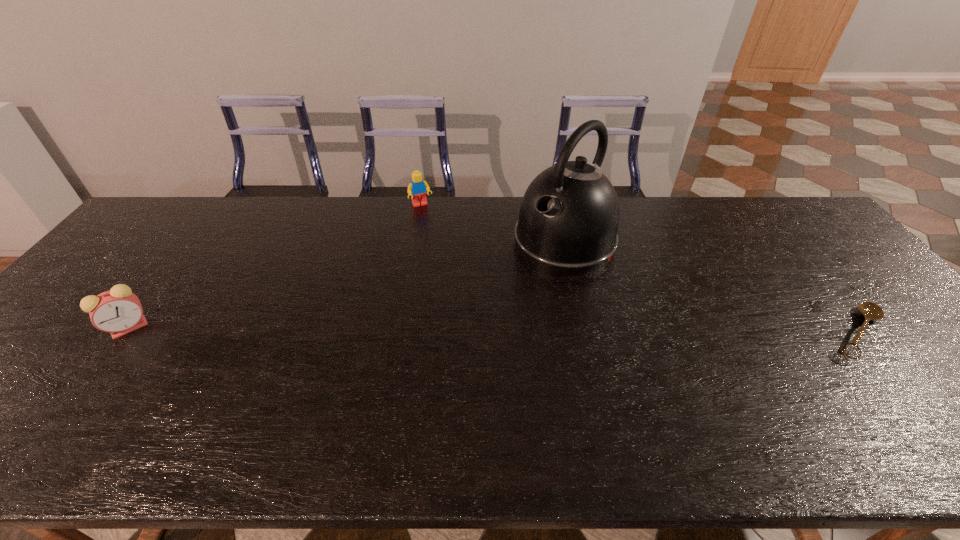
In order to click on free space in the image that satisfies the following two spatial constraints: 1. on the front side of the third object from right to left; 2. on the left side of the third nearest object in this screenshot , I will do `click(416, 241)`.